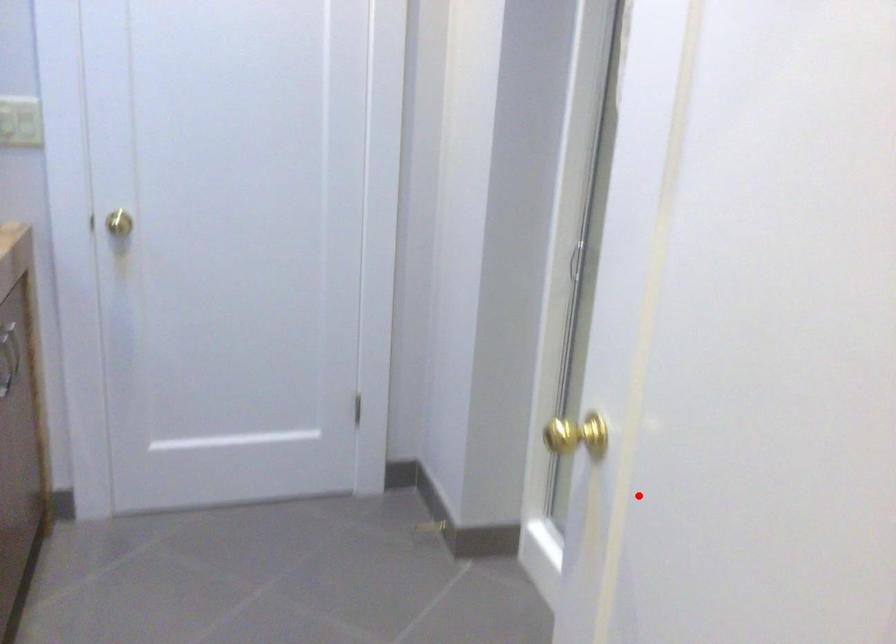
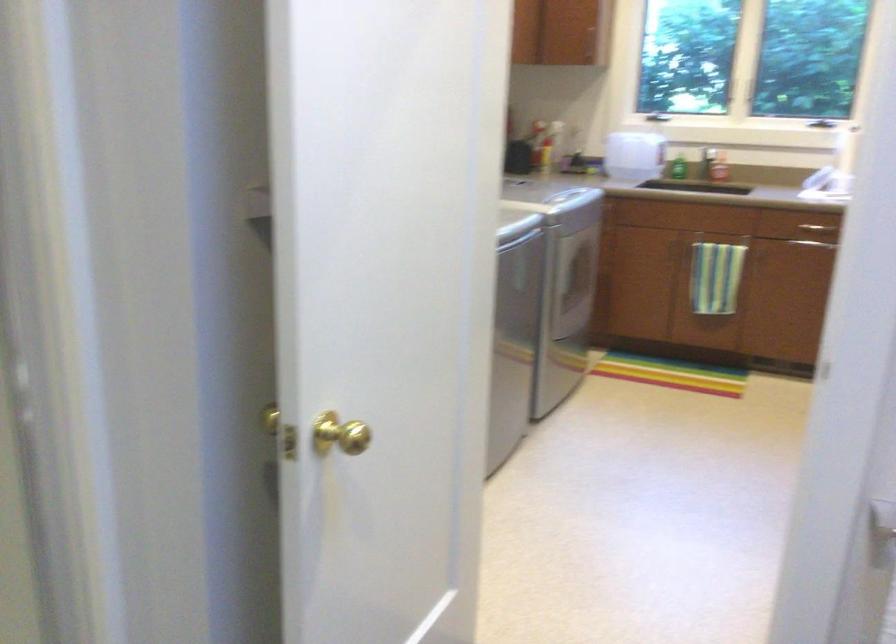
The point at the highlighted location is marked in the first image. Where is the corresponding point in the second image?

(339, 433)